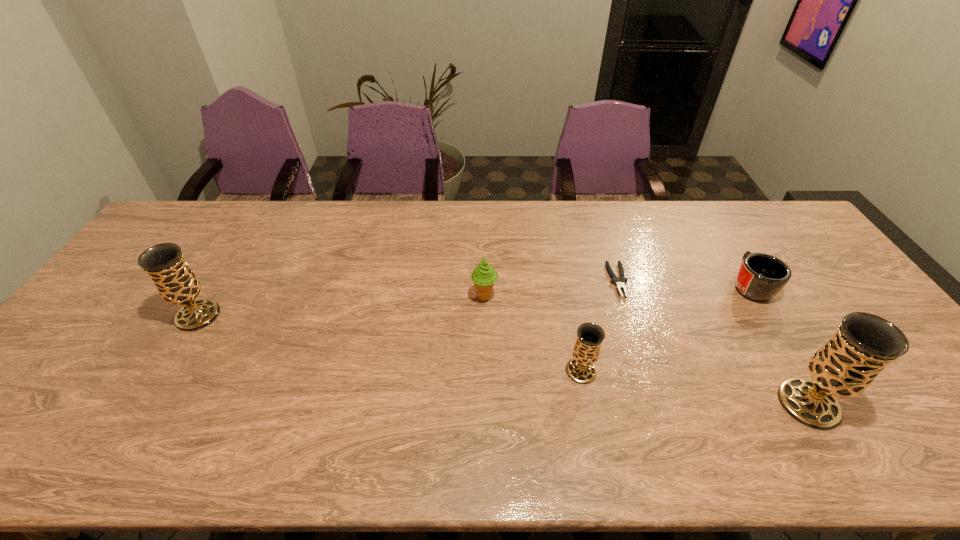
You are a GUI agent. You are given a task and a screenshot of the screen. Output one action in this format:
    pyautogui.click(x=<x>, y=<y>)
    Task: Click on the vacant area at the left edge of the desktop
    
    Given the screenshot: What is the action you would take?
    pyautogui.click(x=80, y=374)

Image resolution: width=960 pixels, height=540 pixels. In the image, there is a desktop. What are the coordinates of `vacant space at the right edge` in the screenshot? It's located at (828, 312).

You are a GUI agent. You are given a task and a screenshot of the screen. Output one action in this format:
    pyautogui.click(x=<x>, y=<y>)
    Task: Click on the vacant position at the far right corner of the desktop
    
    Given the screenshot: What is the action you would take?
    pyautogui.click(x=755, y=230)

You are a GUI agent. You are given a task and a screenshot of the screen. Output one action in this format:
    pyautogui.click(x=<x>, y=<y>)
    Task: Click on the vacant space at the near right corner
    
    Given the screenshot: What is the action you would take?
    pyautogui.click(x=915, y=403)

At what (x,y) coordinates should I click in order to perform the action: click on vacant area that lies between the third object from right to left and the second chalice from right to left. Please return your answer as a coordinate pair (x, y). Looking at the image, I should click on (599, 326).

This screenshot has width=960, height=540. Identify the location of blank region between the rightmost chalice and the third object from left to right. (695, 387).

The width and height of the screenshot is (960, 540). In order to click on vacant space that's between the rightmost chalice and the fourth object from right to left in this screenshot , I will do `click(695, 387)`.

Where is `free point between the mug and the rightmost chalice`? The width and height of the screenshot is (960, 540). free point between the mug and the rightmost chalice is located at coordinates (780, 345).

Identify the location of unoccupied area between the leftmost chalice and the rightmost chalice. (503, 360).

Locate an element on the screen. This screenshot has height=540, width=960. vacant space that's between the fifth tallest object and the third object from left to right is located at coordinates (665, 328).